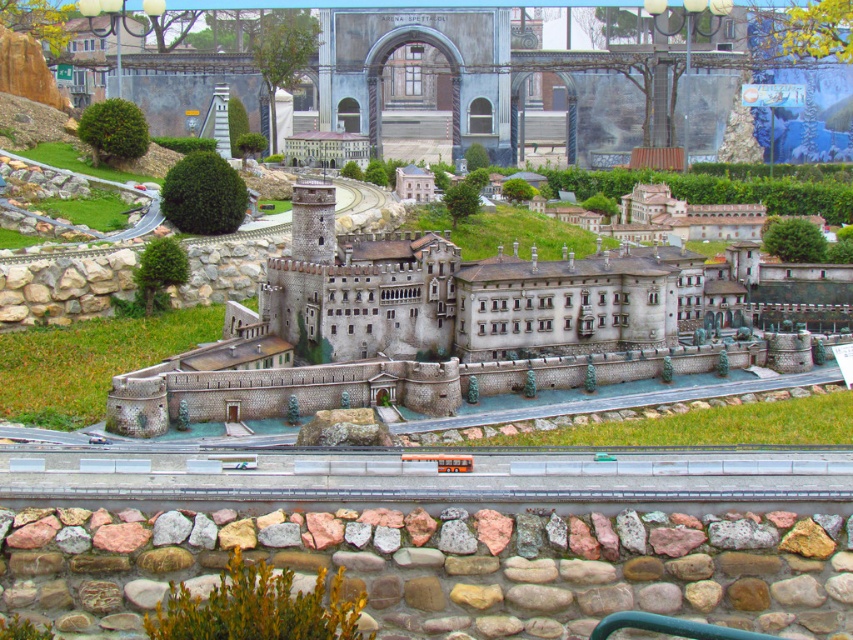
Between stone castle at center and smooth gray train track at center, which one is positioned higher?

stone castle at center is higher up.

The image size is (853, 640). What do you see at coordinates (440, 326) in the screenshot?
I see `stone castle at center` at bounding box center [440, 326].

Is point (531, 394) behind point (107, 484)?

That is True.

Find the location of a particular element. stone castle at center is located at coordinates (440, 326).